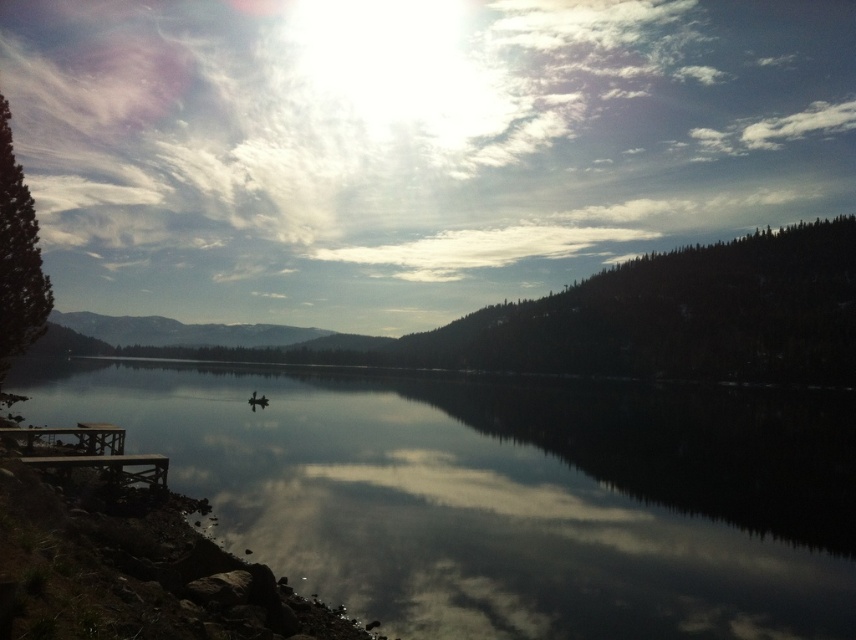
You are planning to have a picnic and need to decide between the wooden picnic table at lower left and a spot on the smooth dark water at center. Which location is bigger and better for spreading out your picnic blanket?

The smooth dark water at center has a larger size compared to the wooden picnic table at lower left, so it would be better for spreading out your picnic blanket.